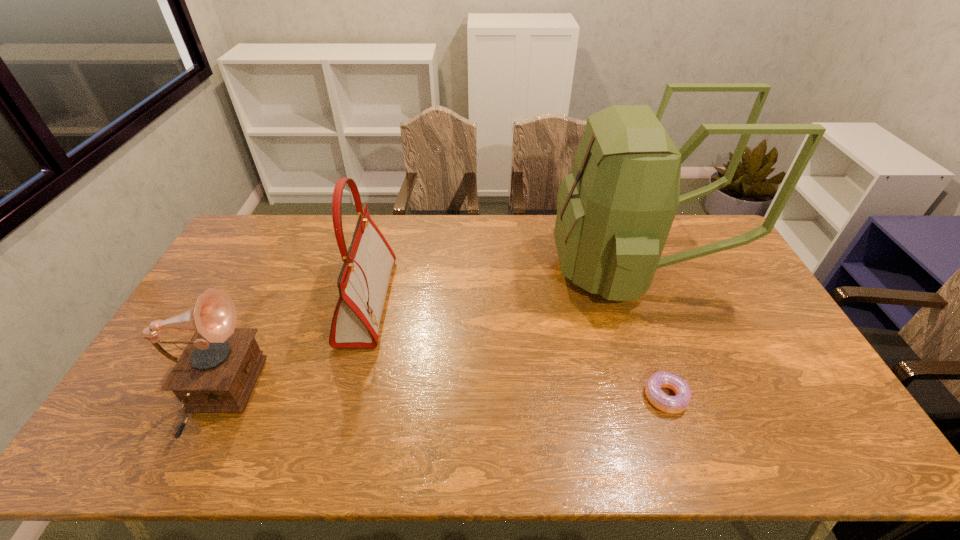
Image resolution: width=960 pixels, height=540 pixels. What are the coordinates of `free point located on the horn of the third tallest object` in the screenshot? It's located at (399, 399).

Identify the location of free space located 0.050m on the left of the shortest object. Image resolution: width=960 pixels, height=540 pixels. (625, 396).

Image resolution: width=960 pixels, height=540 pixels. Find the location of `object located in the far edge section of the desktop`. object located in the far edge section of the desktop is located at coordinates (615, 210).

Where is `object that is at the near edge`? The height and width of the screenshot is (540, 960). object that is at the near edge is located at coordinates (216, 373).

Locate an element on the screen. The width and height of the screenshot is (960, 540). object located in the left edge section of the desktop is located at coordinates (216, 373).

This screenshot has height=540, width=960. In order to click on object located at the right edge in this screenshot , I will do `click(615, 210)`.

Where is `object that is at the near left corner`? The width and height of the screenshot is (960, 540). object that is at the near left corner is located at coordinates (216, 373).

The height and width of the screenshot is (540, 960). Identify the location of object situated at the far right corner. (615, 210).

What are the coordinates of `vacant space at the far edge of the desktop` in the screenshot? It's located at (444, 254).

Find the location of a particular element. Image resolution: width=960 pixels, height=540 pixels. vacant point at the near edge is located at coordinates (257, 452).